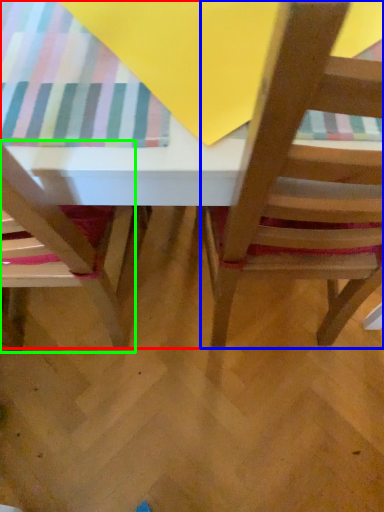
Question: Estimate the real-world distances between objects in this image. Which object is farther from table (highlighted by a red box), chair (highlighted by a blue box) or chair (highlighted by a green box)?

Choices:
 (A) chair
 (B) chair

Answer: (B)